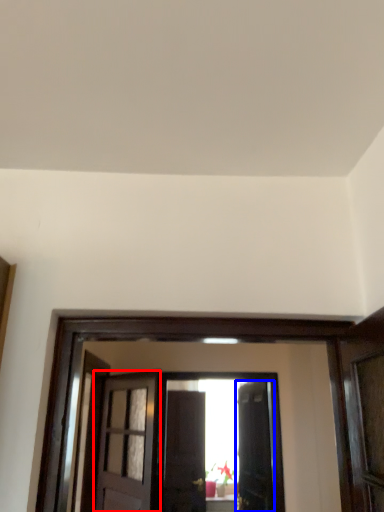
Question: Which object is closer to the camera taking this photo, door (highlighted by a red box) or door (highlighted by a blue box)?

Choices:
 (A) door
 (B) door

Answer: (A)